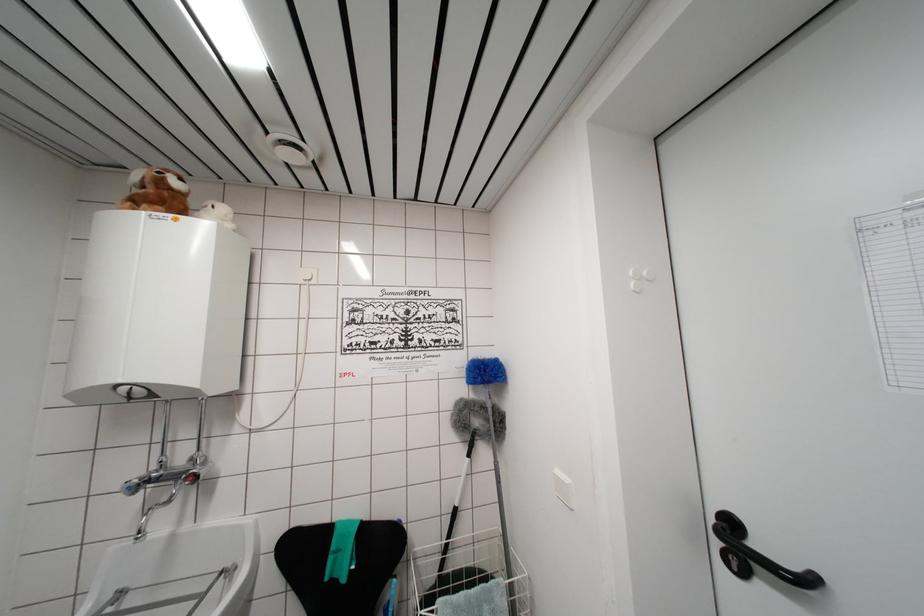
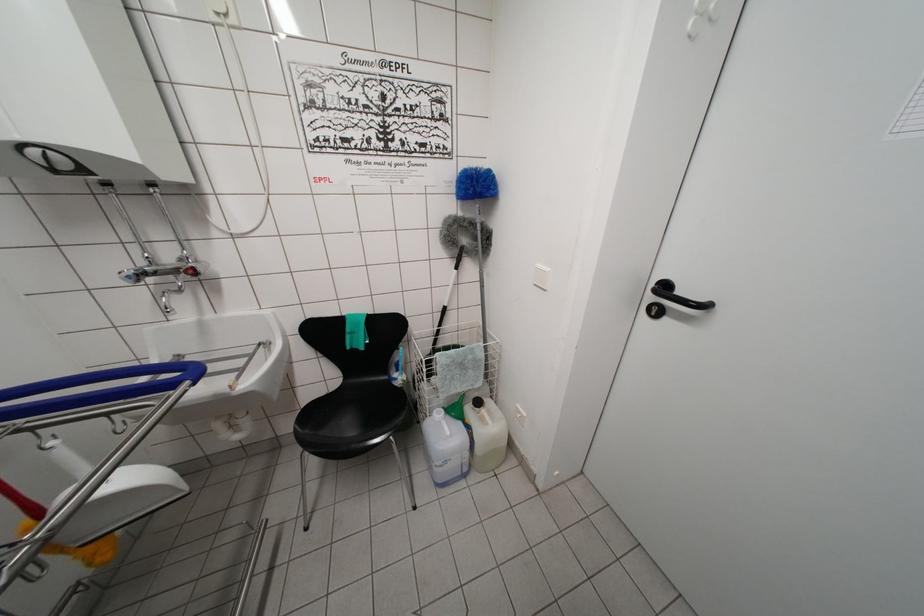
The point at (x=562, y=477) is marked in the first image. Where is the corresponding point in the second image?

(542, 270)